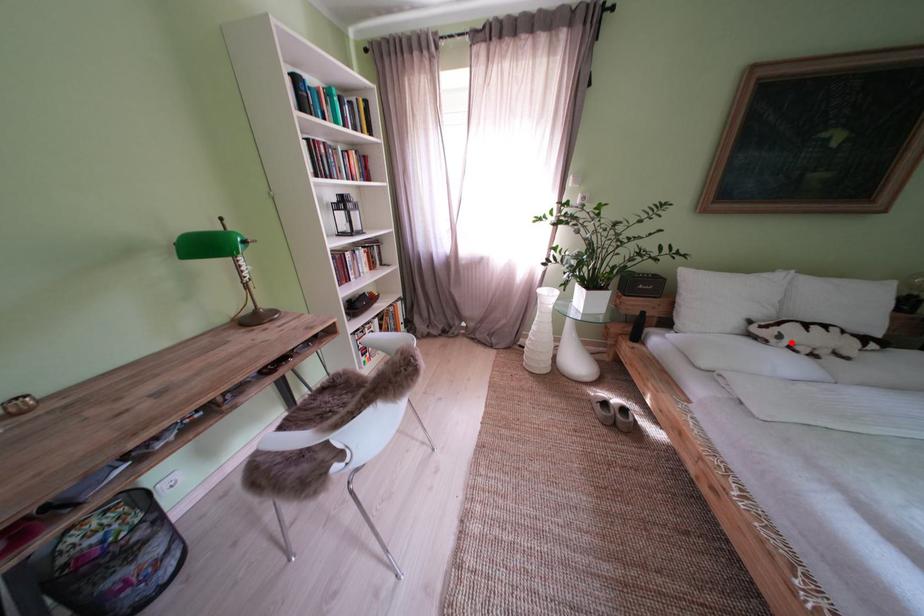
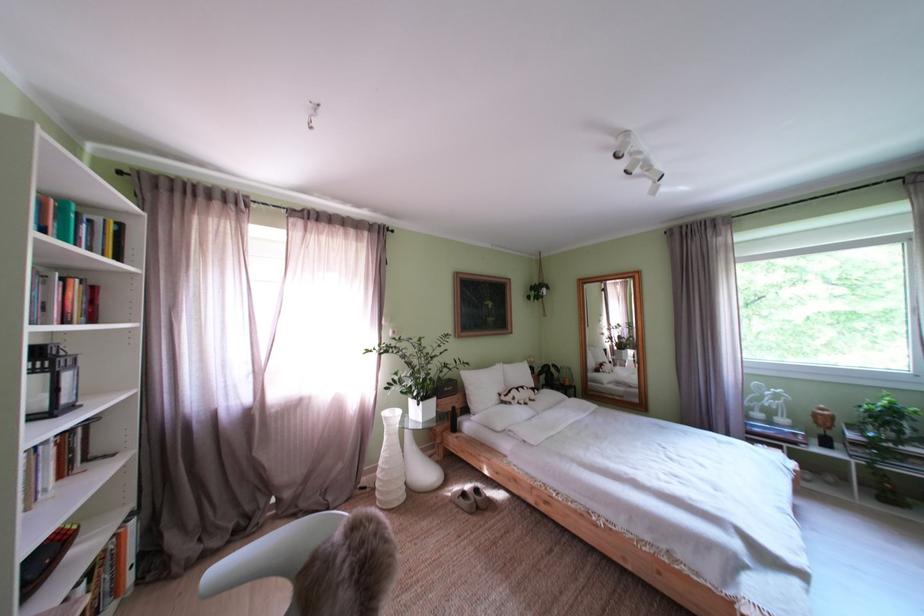
Question: I am providing you with two images of the same scene from different viewpoints. In image1, a red point is highlighted. Considering the same 3D point in image2, which of the following is correct?

Choices:
 (A) It is closer
 (B) It is farther

Answer: (B)